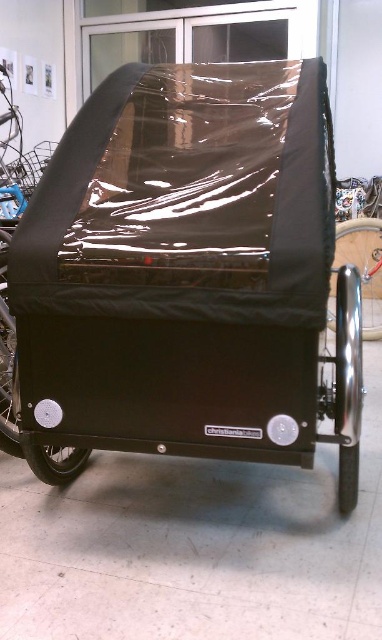
In the scene shown: You are a delivery person who needs to place a small package inside the black cargo bike trailer. The trailer has a cargo area covered by a reflective black tarpaulin. Where should you place the package so it doesn not interfere with the black matte baby carriage at center?

The black matte baby carriage at center is located at point (179, 269), so you should place the package in an area of the cargo area that is not occupied by the black matte baby carriage at center to avoid interference.

You are a mechanic inspecting the wheels of the trailer. You notice two wheels. The polished silver wheel at lower right and the black metallic wheel at right. Which wheel is located lower in position?

Result: The polished silver wheel at lower right is positioned under the black metallic wheel at right, so it is lower in position.